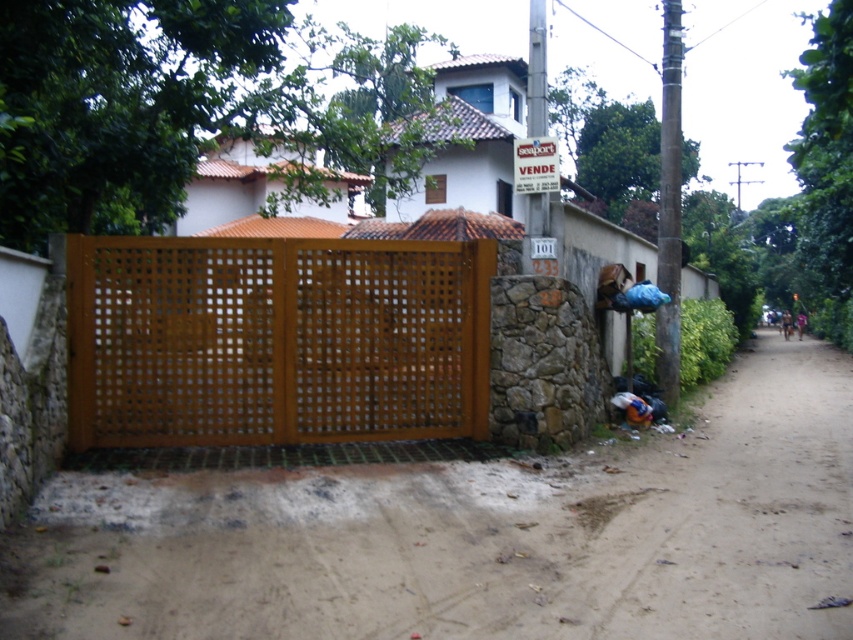
Question: Is brown sandy dirt track at lower center further to the viewer compared to brown wooden fence at center?

Choices:
 (A) yes
 (B) no

Answer: (B)

Question: Is brown sandy dirt track at lower center smaller than brown wooden fence at center?

Choices:
 (A) yes
 (B) no

Answer: (B)

Question: Which of the following is the farthest from the observer?

Choices:
 (A) brown sandy dirt track at lower center
 (B) brown wooden fence at center

Answer: (B)

Question: Does brown sandy dirt track at lower center have a greater width compared to brown wooden fence at center?

Choices:
 (A) no
 (B) yes

Answer: (B)